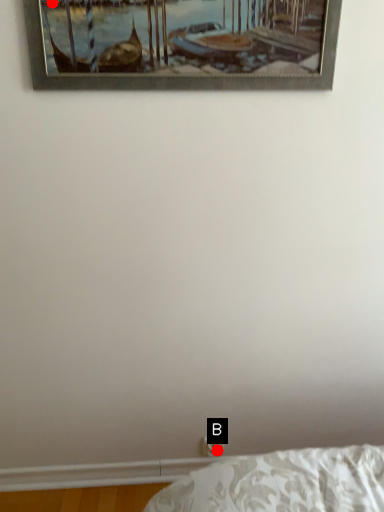
Question: Two points are circled on the image, labeled by A and B beside each circle. Which point is closer to the camera?

Choices:
 (A) A is closer
 (B) B is closer

Answer: (A)